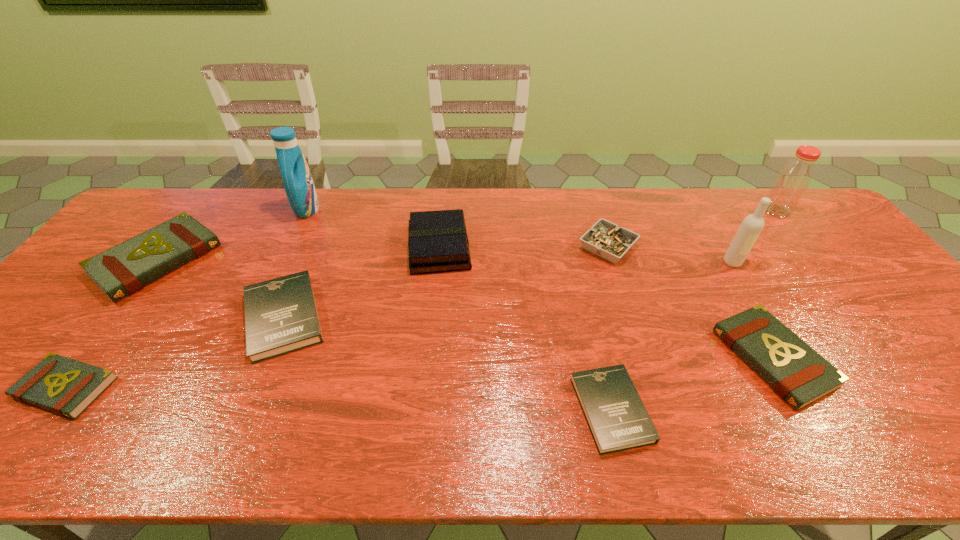
This screenshot has height=540, width=960. I want to click on blank region between the ashtray and the bigger dark book, so click(x=445, y=282).

What are the coordinates of `unoccupied area between the red bottle and the gray ashtray` in the screenshot? It's located at (692, 229).

Where is `vacant area that lies between the left dark book and the gray ashtray`? vacant area that lies between the left dark book and the gray ashtray is located at coordinates (445, 282).

The height and width of the screenshot is (540, 960). Identify the location of free space that is in between the nearer dark book and the biggest brown book. (384, 335).

Where is `object that can be found as the fourth closest to the detergent`? object that can be found as the fourth closest to the detergent is located at coordinates (62, 385).

At what (x,y) coordinates should I click in order to perform the action: click on object that is the seventh closest one to the third book from left to right. Please return your answer as a coordinate pair (x, y). The width and height of the screenshot is (960, 540). Looking at the image, I should click on (797, 373).

Find the location of a particular element. the fifth closest book to the vodka is located at coordinates (124, 269).

Locate an element on the screen. This screenshot has width=960, height=540. book that is the closest to the white vodka is located at coordinates (797, 373).

Find the location of a particular element. The image size is (960, 540). the second closest brown book to the detergent is located at coordinates (62, 385).

Choose which brown book is the second nearest neighbor to the white vodka. Please provide its 2D coordinates. Your answer should be formatted as a tuple, i.e. [(x, y)], where the tuple contains the x and y coordinates of a point satisfying the conditions above.

[(124, 269)]